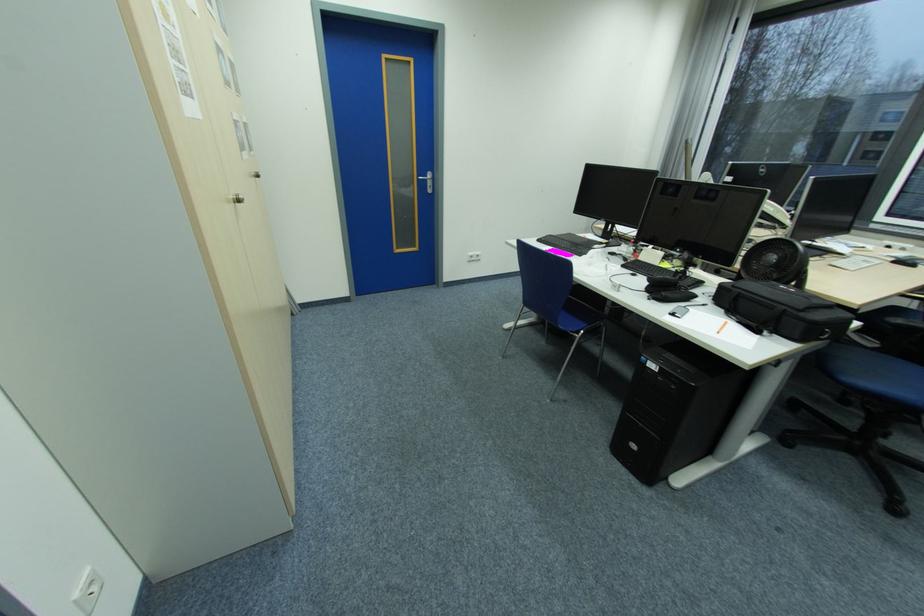
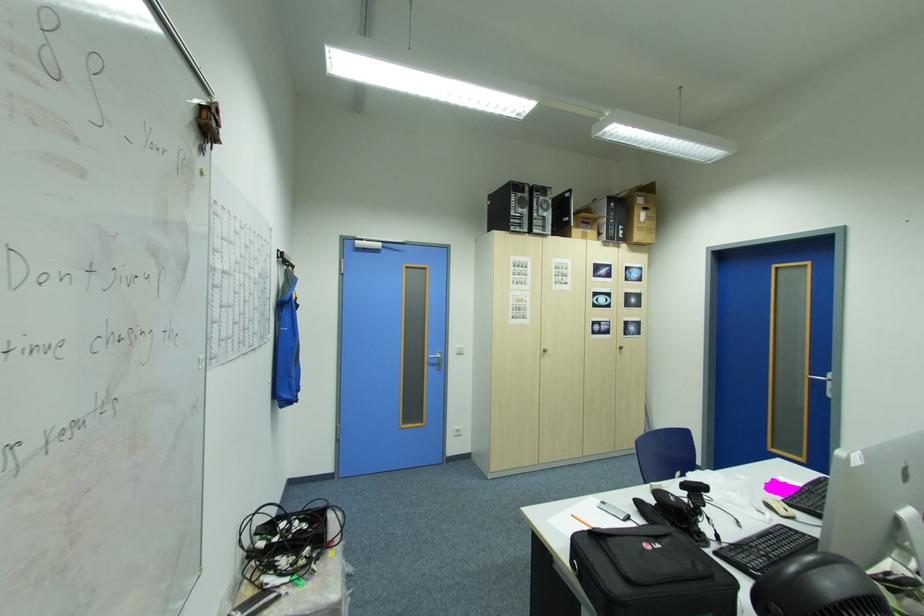
Where in the second image is the point corresponding to point (436, 192) from the first image?

(836, 397)